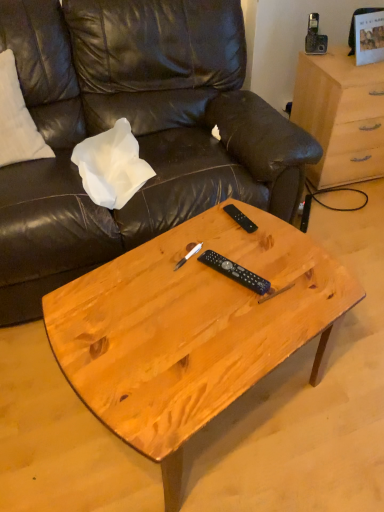
Locate an element on the screen. vacant space that's between black plastic remote at center, the second remote in the back-to-front sequence, and black plastic remote at center, placed as the second remote when sorted from bottom to top is located at coordinates (237, 248).